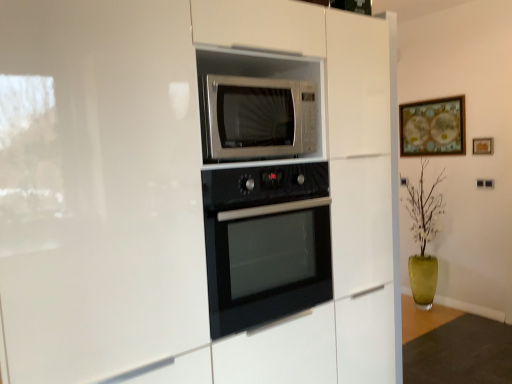
Question: Can you confirm if black glass oven at center is positioned to the right of satin silver microwave at center?

Choices:
 (A) no
 (B) yes

Answer: (B)

Question: From a real-world perspective, is black glass oven at center located beneath satin silver microwave at center?

Choices:
 (A) yes
 (B) no

Answer: (A)

Question: Is satin silver microwave at center at the back of black glass oven at center?

Choices:
 (A) no
 (B) yes

Answer: (A)

Question: Is black glass oven at center not within satin silver microwave at center?

Choices:
 (A) no
 (B) yes

Answer: (B)

Question: Would you say black glass oven at center is a long distance from satin silver microwave at center?

Choices:
 (A) no
 (B) yes

Answer: (A)

Question: Based on their sizes in the image, would you say satin silver microwave at center is bigger or smaller than wooden framed map at upper right, arranged as the first picture frame when viewed from the left?

Choices:
 (A) big
 (B) small

Answer: (B)

Question: From the image's perspective, relative to wooden framed map at upper right, which appears as the second picture frame when viewed from the front, is satin silver microwave at center above or below?

Choices:
 (A) above
 (B) below

Answer: (B)

Question: Is point (309, 84) positioned closer to the camera than point (431, 102)?

Choices:
 (A) closer
 (B) farther

Answer: (A)

Question: In the image, is satin silver microwave at center positioned in front of or behind wooden framed map at upper right, which appears as the second picture frame when viewed from the front?

Choices:
 (A) front
 (B) behind

Answer: (A)

Question: From a real-world perspective, is wooden picture frame at upper right, the 1th picture frame when ordered from right to left, physically located above or below satin silver microwave at center?

Choices:
 (A) below
 (B) above

Answer: (A)

Question: In terms of height, does wooden picture frame at upper right, the second picture frame when ordered from back to front, look taller or shorter compared to satin silver microwave at center?

Choices:
 (A) short
 (B) tall

Answer: (A)

Question: Is wooden picture frame at upper right, which appears as the 2th picture frame when viewed from the left, wider or thinner than satin silver microwave at center?

Choices:
 (A) thin
 (B) wide

Answer: (A)

Question: Looking at the image, does wooden picture frame at upper right, the second picture frame when ordered from back to front, seem bigger or smaller compared to satin silver microwave at center?

Choices:
 (A) big
 (B) small

Answer: (B)

Question: From a real-world perspective, is satin silver microwave at center positioned above or below black glass oven at center?

Choices:
 (A) above
 (B) below

Answer: (A)

Question: Does point (226, 77) appear closer or farther from the camera than point (288, 223)?

Choices:
 (A) closer
 (B) farther

Answer: (A)